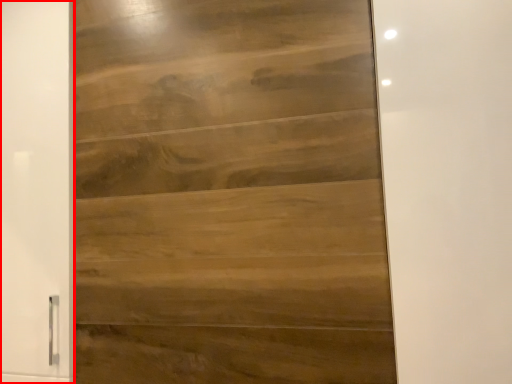
Question: Where is barn door (annotated by the red box) located in relation to door in the image?

Choices:
 (A) left
 (B) right

Answer: (A)